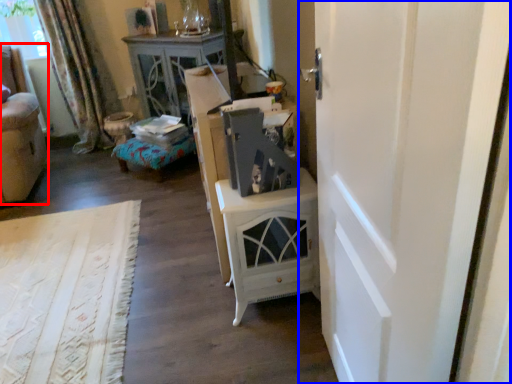
Question: Which object appears closest to the camera in this image, furniture (highlighted by a red box) or door (highlighted by a blue box)?

Choices:
 (A) furniture
 (B) door

Answer: (B)